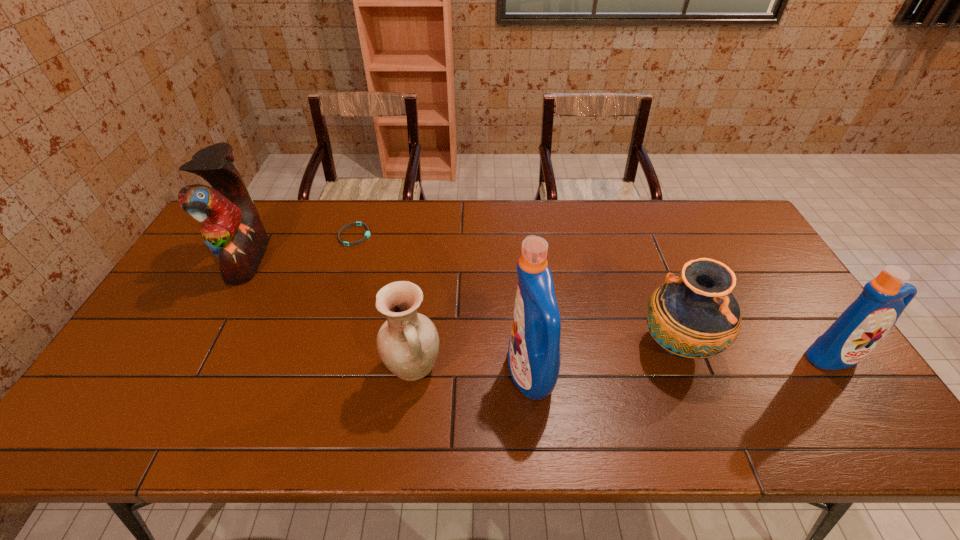
Image resolution: width=960 pixels, height=540 pixels. Find the location of `vacant space in between the wristband and the taller detergent`. vacant space in between the wristband and the taller detergent is located at coordinates (443, 305).

Locate an element on the screen. unoccupied position between the left pottery and the parrot is located at coordinates (330, 314).

Image resolution: width=960 pixels, height=540 pixels. In order to click on free space between the second object from left to right and the third object from right to left in this screenshot , I will do `click(443, 305)`.

Where is `vacant space that is in between the right pottery and the parrot`? vacant space that is in between the right pottery and the parrot is located at coordinates (463, 302).

The image size is (960, 540). Identify the location of free area in between the fourth object from right to left and the parrot. (330, 314).

At what (x,y) coordinates should I click in order to perform the action: click on object that is the fifth closest to the third object from left to right. Please return your answer as a coordinate pair (x, y). Looking at the image, I should click on (862, 326).

Choose which object is the nearest neighbor to the right pottery. Please provide its 2D coordinates. Your answer should be formatted as a tuple, i.e. [(x, y)], where the tuple contains the x and y coordinates of a point satisfying the conditions above.

[(862, 326)]

You are a GUI agent. You are given a task and a screenshot of the screen. Output one action in this format:
    pyautogui.click(x=<x>, y=<y>)
    Task: Click on the free point that satisfies the following two spatial constraints: 1. on the buckle of the wristband; 2. on the back side of the right pottery
    
    Given the screenshot: What is the action you would take?
    pyautogui.click(x=321, y=346)

Identify the location of vacant space that satisfies the following two spatial constraints: 1. on the buckle of the shortest object; 2. on the back side of the right pottery. (321, 346).

Where is `free space that satisfies the following two spatial constraints: 1. on the buckle of the shortest object; 2. on the back side of the second object from right to left`? The width and height of the screenshot is (960, 540). free space that satisfies the following two spatial constraints: 1. on the buckle of the shortest object; 2. on the back side of the second object from right to left is located at coordinates (321, 346).